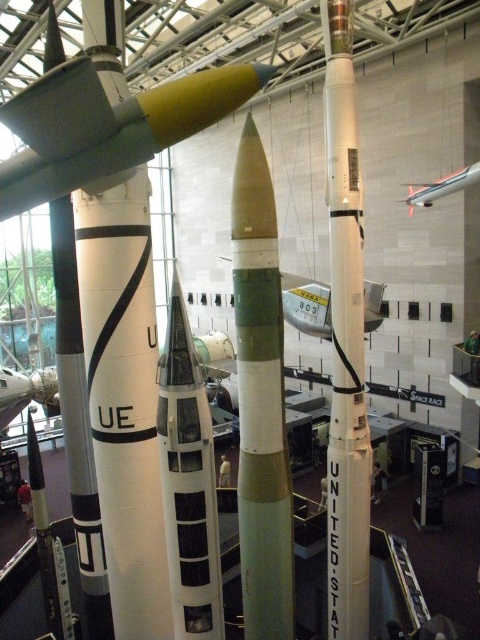
Question: Is white matte rocket at center thinner than metallic silver airplane at upper right?

Choices:
 (A) no
 (B) yes

Answer: (A)

Question: Among these objects, which one is farthest from the camera?

Choices:
 (A) green matte rocket at center
 (B) metallic silver airplane at upper right
 (C) white matte rocket at center

Answer: (B)

Question: Does white matte rocket at center have a greater width compared to metallic silver airplane at upper right?

Choices:
 (A) yes
 (B) no

Answer: (A)

Question: Does green matte rocket at center have a smaller size compared to white glossy rocket at center?

Choices:
 (A) no
 (B) yes

Answer: (A)

Question: Which object is closer to the camera taking this photo?

Choices:
 (A) white glossy rocket at center
 (B) white matte rocket at center
 (C) green matte rocket at center

Answer: (A)

Question: Among these points, which one is farthest from the camera?

Choices:
 (A) (455, 189)
 (B) (344, 634)
 (C) (269, 614)

Answer: (A)